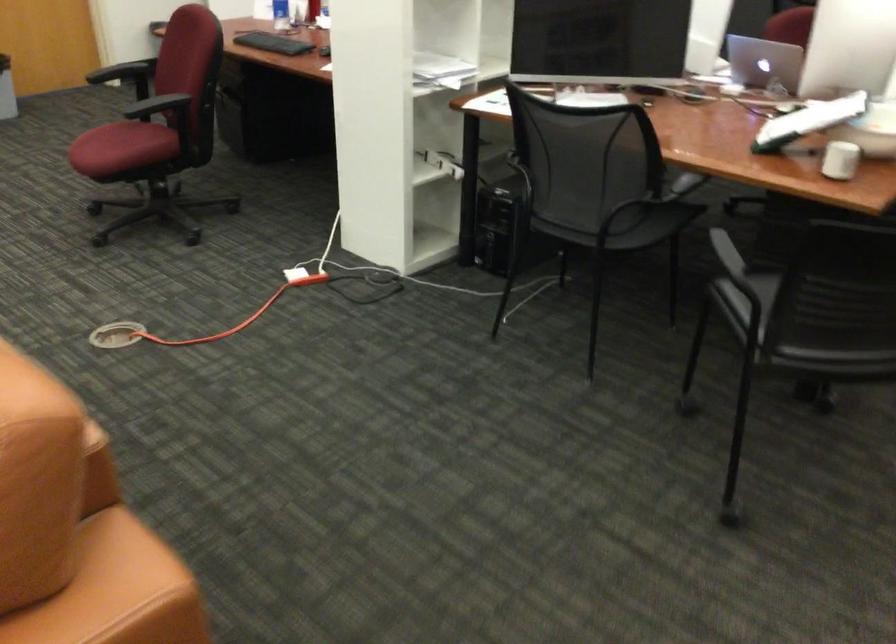
Locate an element on the screen. The width and height of the screenshot is (896, 644). red chair armrest is located at coordinates (154, 96).